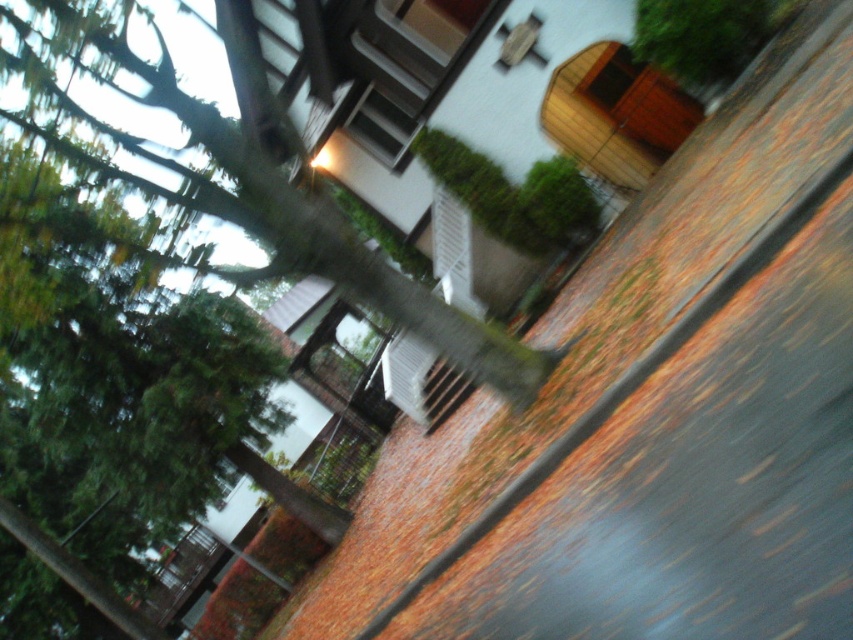
Looking at this image, you are standing in the twilight scene and want to take a photo of the green leafy tree at upper left without the green leafy tree at upper right blocking it. How should you position yourself relative to the trees?

Since the green leafy tree at upper left is below the green leafy tree at upper right, you should position yourself lower to frame the green leafy tree at upper left so that the green leafy tree at upper right does not block it.

You are standing in front of the green leafy tree at upper left and want to take a photo of the entire tree without moving your camera position. Given that the tree is 4.54 meters away from the camera, what is the minimum distance you should step back to ensure the entire tree fits in the frame?

To ensure the entire green leafy tree at upper left fits in the frame when it is 4.54 meters away, you should step back at least 4.54 meters from the tree.